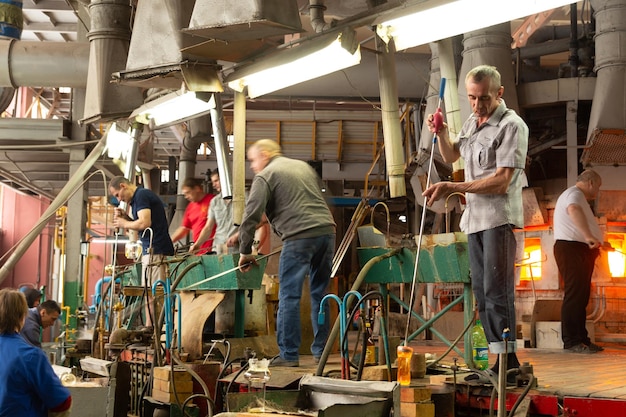
I want to click on beam, so click(62, 225).